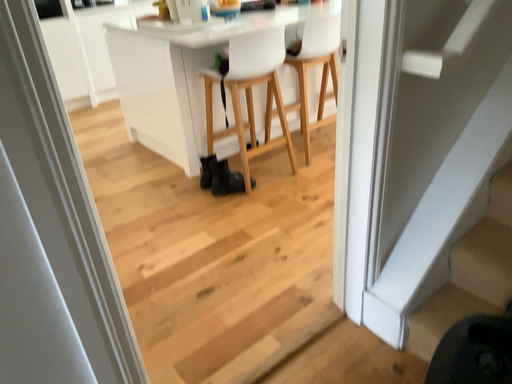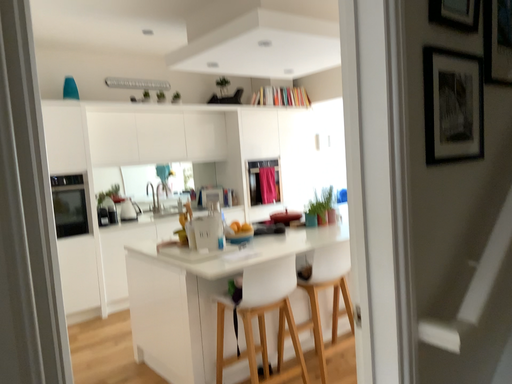
Question: How did the camera likely rotate when shooting the video?

Choices:
 (A) rotated downward
 (B) rotated upward

Answer: (B)